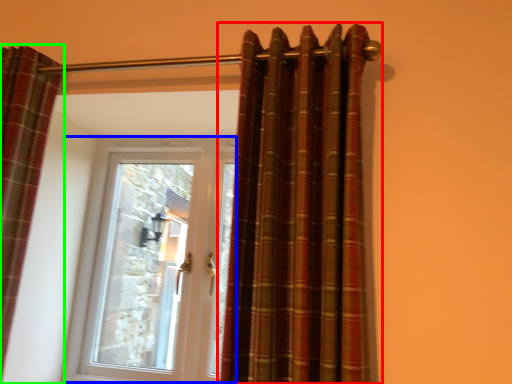
Question: Considering the real-world distances, which object is closest to curtain (highlighted by a red box)? door (highlighted by a blue box) or curtain (highlighted by a green box).

Choices:
 (A) door
 (B) curtain

Answer: (B)